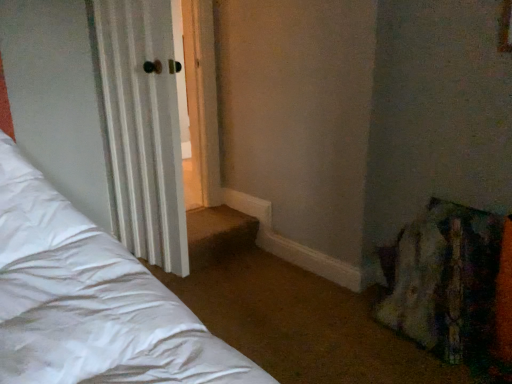
Identify the location of white wood door at left. The height and width of the screenshot is (384, 512). (143, 128).

Describe the element at coordinates (143, 128) in the screenshot. I see `white wood door at left` at that location.

Measure the distance between white wood door at left and camera.

white wood door at left is 1.68 meters from camera.

The height and width of the screenshot is (384, 512). I want to click on white wood door at left, so click(143, 128).